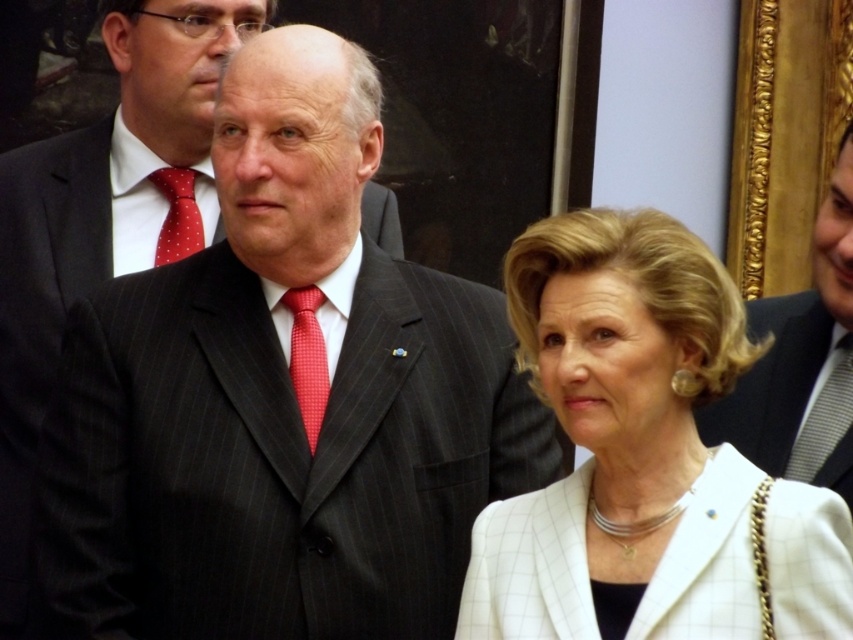
Question: Which object is farther from the camera taking this photo?

Choices:
 (A) gray striped tie at right
 (B) dark pinstripe suit at center
 (C) red dotted tie at center
 (D) white textured blazer at center

Answer: (C)

Question: Which point is closer to the camera?

Choices:
 (A) white textured blazer at center
 (B) red dotted tie at center

Answer: (A)

Question: Is dark pinstripe suit at center closer to camera compared to white textured blazer at center?

Choices:
 (A) no
 (B) yes

Answer: (A)

Question: Is white textured blazer at center below gray striped tie at right?

Choices:
 (A) yes
 (B) no

Answer: (A)

Question: Can you confirm if dark pinstripe suit at center is positioned below white textured blazer at center?

Choices:
 (A) yes
 (B) no

Answer: (B)

Question: Which object is positioned closest to the dark pinstripe suit at center?

Choices:
 (A) white checkered blazer at center
 (B) gray striped tie at right

Answer: (A)